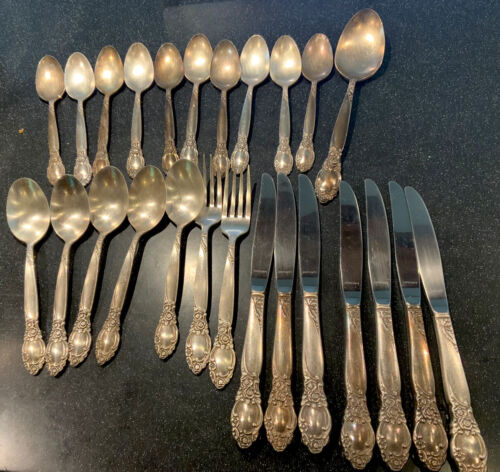
Locate an element on the screen. The image size is (500, 472). small spoons is located at coordinates (46, 87), (74, 84), (110, 75), (139, 71), (169, 66), (197, 59), (234, 66), (263, 63), (284, 59), (319, 59).